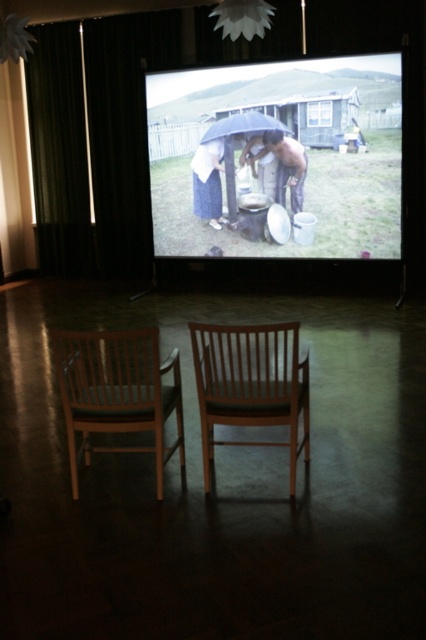
Question: Considering the real-world distances, which object is farthest from the matte black umbrella at center?

Choices:
 (A) wooden chair at center
 (B) wooden chair at lower left
 (C) black matte umbrella at center
 (D) smooth beige fabric umbrella at center

Answer: (B)

Question: Is shiny metallic bucket at center positioned before black matte umbrella at center?

Choices:
 (A) yes
 (B) no

Answer: (B)

Question: Considering the relative positions of shiny metallic bucket at center and black matte umbrella at center in the image provided, where is shiny metallic bucket at center located with respect to black matte umbrella at center?

Choices:
 (A) left
 (B) right

Answer: (B)

Question: Among these objects, which one is nearest to the camera?

Choices:
 (A) matte black umbrella at center
 (B) dark green fabric curtain at left

Answer: (A)

Question: Does wooden chair at lower left appear over wooden chair at center?

Choices:
 (A) yes
 (B) no

Answer: (A)

Question: Based on their relative distances, which object is farther from the dark green fabric curtain at left?

Choices:
 (A) shiny metallic bucket at center
 (B) matte blue dress at center

Answer: (A)